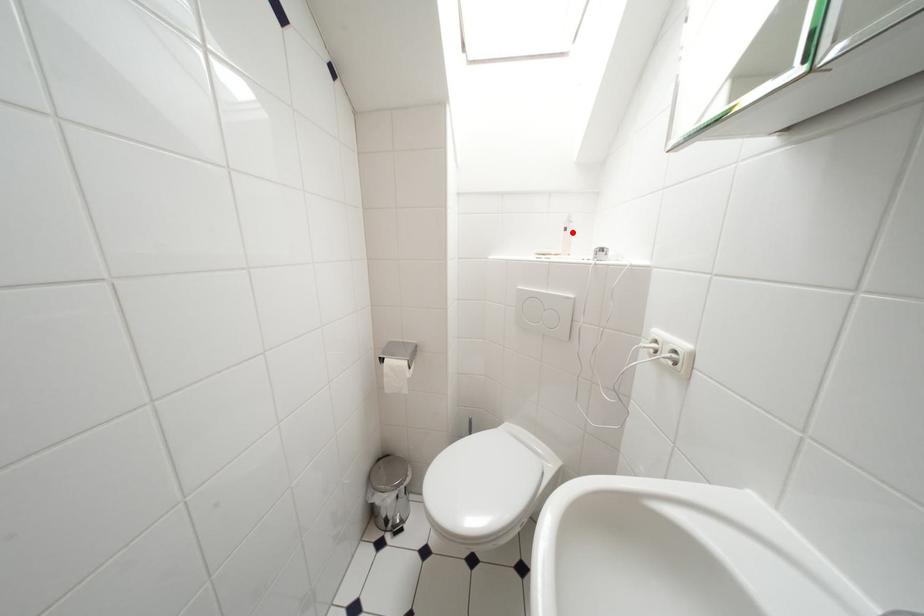
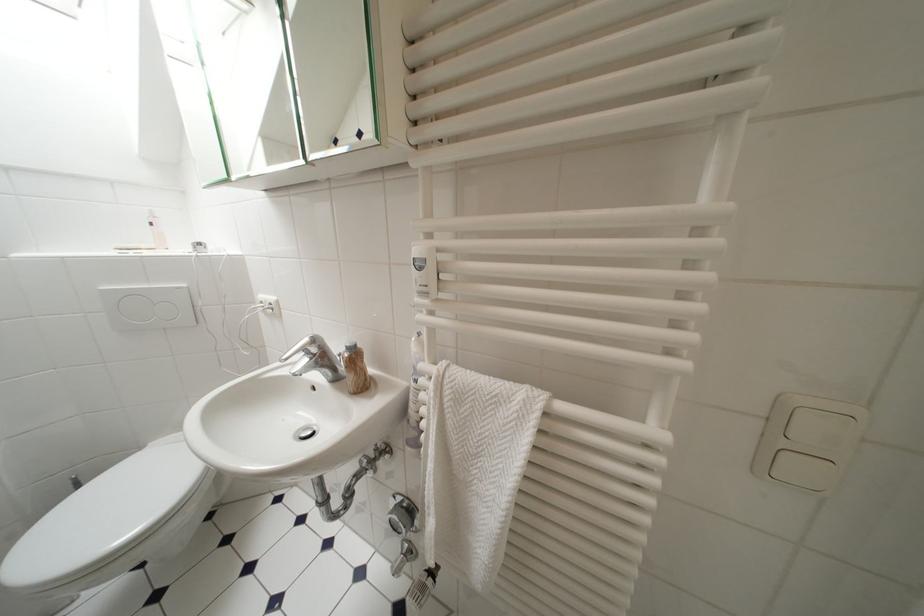
Locate, in the second image, the point that corresponds to the highlighted location in the first image.

(159, 227)